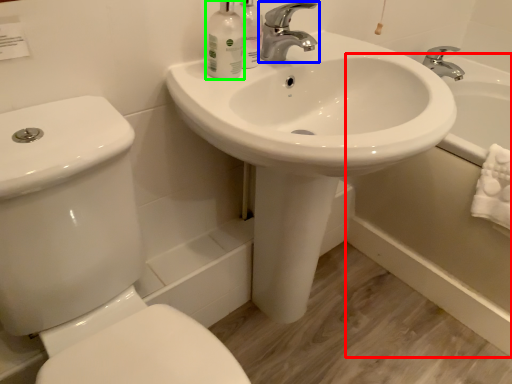
Question: Which is nearer to the bath (highlighted by a red box)? tap (highlighted by a blue box) or mouthwash (highlighted by a green box).

Choices:
 (A) tap
 (B) mouthwash

Answer: (A)